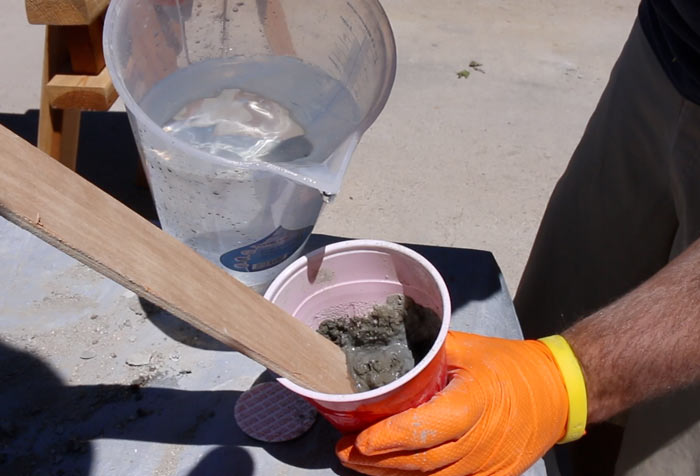
This screenshot has width=700, height=476. I want to click on wooden bench, so click(60, 9).